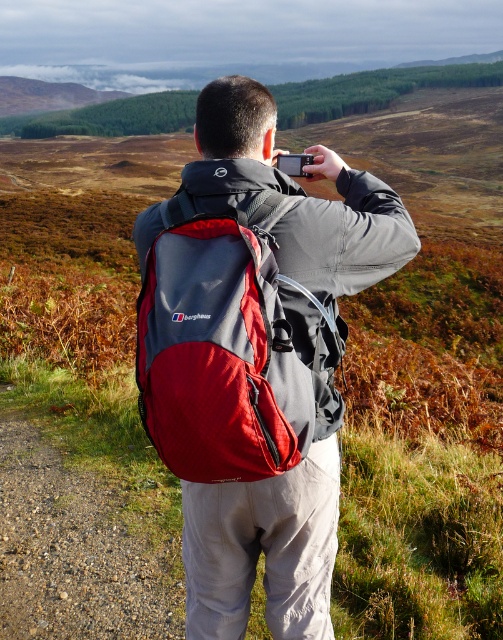
You are a photographer planning to take a photo of the scenic landscape. You have a matte gray backpack at center and a black plastic camera at upper center. Which object is taller?

The matte gray backpack at center is taller than the black plastic camera at upper center.

You are the photographer in the scene. You notice two points of interest in your frame, one at point coordinates point (x=154, y=317) and another at point coordinates point (x=282, y=163). Which point is closer to your camera lens?

Point (x=154, y=317) is closer to the camera lens than point (x=282, y=163).

You are a photographer planning to take a wide landscape photo. You have a red fabric backpack at back and a black plastic camera at upper center. Which object should you adjust first to ensure the camera can capture the entire scene?

You should adjust the red fabric backpack at back first because it is larger in size than the black plastic camera at upper center, so it might block the camera view if not moved out of the way.